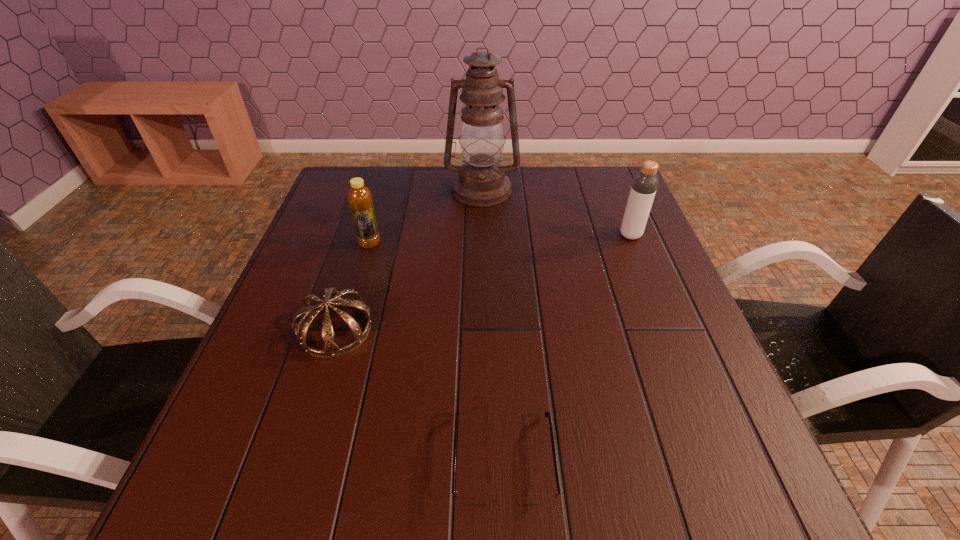
Locate an element on the screen. This screenshot has width=960, height=540. free space at the far left corner of the desktop is located at coordinates (347, 195).

Find the location of a particular element. The height and width of the screenshot is (540, 960). free space at the far right corner is located at coordinates (585, 182).

I want to click on vacant point located between the shortest object and the right bottle, so click(x=567, y=348).

This screenshot has height=540, width=960. I want to click on empty space that is in between the nearest object and the fourth tallest object, so click(420, 396).

Locate an element on the screen. The image size is (960, 540). vacant area that lies between the right bottle and the tiara is located at coordinates (483, 282).

Find the location of `free space between the rightmost object and the left bottle`. free space between the rightmost object and the left bottle is located at coordinates (500, 239).

This screenshot has height=540, width=960. Find the location of `vacant area between the oil lamp and the right bottle`. vacant area between the oil lamp and the right bottle is located at coordinates (556, 213).

Where is `free space between the fourth farthest object and the left bottle`? This screenshot has height=540, width=960. free space between the fourth farthest object and the left bottle is located at coordinates (352, 287).

Locate an element on the screen. This screenshot has width=960, height=540. free point between the left bottle and the oil lamp is located at coordinates coord(426,217).

The width and height of the screenshot is (960, 540). Identify the location of free space that is in between the left bottle and the second nearest object. (352, 287).